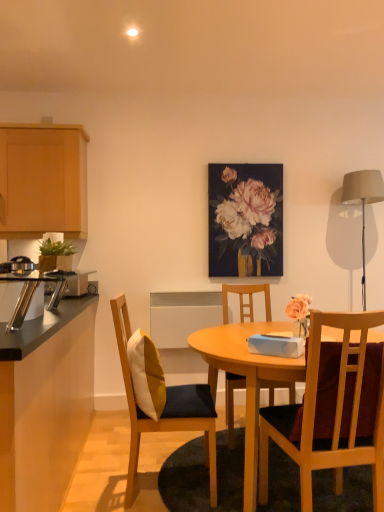
Question: Is metallic silver toaster at left, positioned as the second appliance in left-to-right order, closer to the viewer compared to light wood cabinet at upper left, the second cabinetry positioned from the bottom?

Choices:
 (A) yes
 (B) no

Answer: (A)

Question: Is metallic silver toaster at left, acting as the 1th appliance starting from the right, oriented away from light wood cabinet at upper left, the 1th cabinetry from the top?

Choices:
 (A) no
 (B) yes

Answer: (A)

Question: Considering the relative sizes of metallic silver toaster at left, acting as the 1th appliance starting from the right, and light wood cabinet at upper left, the 1th cabinetry from the top, in the image provided, is metallic silver toaster at left, acting as the 1th appliance starting from the right, wider than light wood cabinet at upper left, the 1th cabinetry from the top,?

Choices:
 (A) yes
 (B) no

Answer: (B)

Question: Is metallic silver toaster at left, the first appliance in the front-to-back sequence, located outside light wood cabinet at upper left, the second cabinetry positioned from the bottom?

Choices:
 (A) no
 (B) yes

Answer: (B)

Question: Is metallic silver toaster at left, acting as the 1th appliance starting from the right, taller than light wood cabinet at upper left, the second cabinetry positioned from the bottom?

Choices:
 (A) yes
 (B) no

Answer: (B)

Question: In terms of height, does black laminate countertop at left, the 1th cabinetry ordered from the bottom, look taller or shorter compared to metallic silver toaster at left, the first appliance in the front-to-back sequence?

Choices:
 (A) tall
 (B) short

Answer: (A)

Question: In the image, is black laminate countertop at left, the 1th cabinetry ordered from the bottom, on the left side or the right side of metallic silver toaster at left, the 2th appliance viewed from the back?

Choices:
 (A) left
 (B) right

Answer: (A)

Question: In terms of size, does black laminate countertop at left, the 2th cabinetry from the top, appear bigger or smaller than metallic silver toaster at left, positioned as the second appliance in left-to-right order?

Choices:
 (A) small
 (B) big

Answer: (B)

Question: From the image's perspective, is black laminate countertop at left, the 1th cabinetry ordered from the bottom, located above or below metallic silver toaster at left, the first appliance in the front-to-back sequence?

Choices:
 (A) above
 (B) below

Answer: (B)

Question: From a real-world perspective, is matte gray lampshade at right positioned above or below wooden chair at center, which is counted as the 2th chair, starting from the left?

Choices:
 (A) above
 (B) below

Answer: (A)

Question: Is matte gray lampshade at right bigger or smaller than wooden chair at center, arranged as the 1th chair when viewed from the back?

Choices:
 (A) big
 (B) small

Answer: (B)

Question: Considering the relative positions of matte gray lampshade at right and wooden chair at center, which is counted as the 2th chair, starting from the left, in the image provided, is matte gray lampshade at right to the left or to the right of wooden chair at center, which is counted as the 2th chair, starting from the left,?

Choices:
 (A) right
 (B) left

Answer: (A)

Question: In the image, is matte gray lampshade at right positioned in front of or behind wooden chair at center, which is counted as the 2th chair, starting from the left?

Choices:
 (A) front
 (B) behind

Answer: (B)

Question: Considering the positions of wooden chair at center, placed as the first chair when sorted from front to back, and satin silver toaster at left, which is counted as the 2th appliance, starting from the front, in the image, is wooden chair at center, placed as the first chair when sorted from front to back, bigger or smaller than satin silver toaster at left, which is counted as the 2th appliance, starting from the front,?

Choices:
 (A) small
 (B) big

Answer: (B)

Question: In terms of width, does wooden chair at center, which is counted as the 3th chair, starting from the back, look wider or thinner when compared to satin silver toaster at left, arranged as the first appliance when viewed from the back?

Choices:
 (A) thin
 (B) wide

Answer: (B)